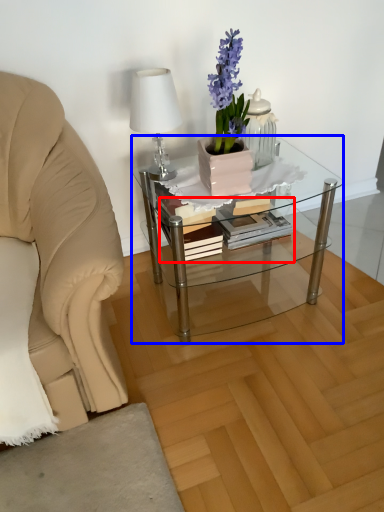
Question: Which point is further to the camera, book (highlighted by a red box) or coffee table (highlighted by a blue box)?

Choices:
 (A) book
 (B) coffee table

Answer: (A)